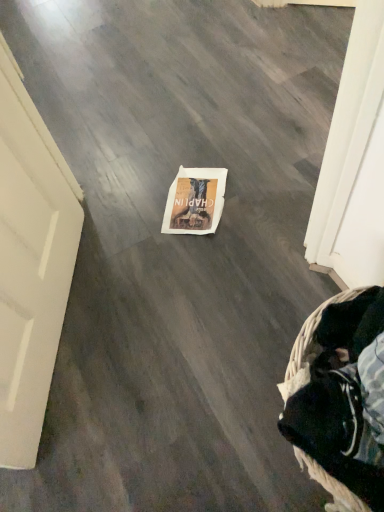
Locate an element on the screen. The image size is (384, 512). vacant space situated on the left part of woven fabric basket at lower right is located at coordinates (203, 420).